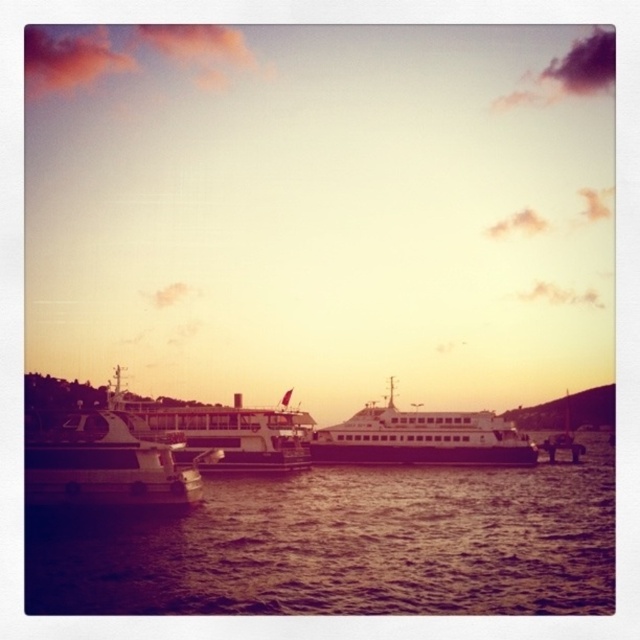
Who is higher up, brown water at center or metallic white ferry at center?

metallic white ferry at center is above.

Which is in front, point (538, 492) or point (177, 408)?

Positioned in front is point (538, 492).

The image size is (640, 640). Find the location of `brown water at center`. brown water at center is located at coordinates (342, 545).

Between point (515, 586) and point (84, 413), which one is positioned in front?

Point (515, 586) is more forward.

Is brown water at center further to camera compared to white glossy ferry at left?

That is False.

Between point (131, 579) and point (202, 483), which one is positioned in front?

Positioned in front is point (131, 579).

I want to click on brown water at center, so click(x=342, y=545).

Which is behind, point (29, 484) or point (385, 422)?

The point (385, 422) is behind.

Based on the photo, who is higher up, white glossy ferry at left or white matte boat at center?

white glossy ferry at left is above.

Which is in front, point (161, 499) or point (388, 442)?

Positioned in front is point (161, 499).

Find the location of a particular element. white glossy ferry at left is located at coordinates (109, 464).